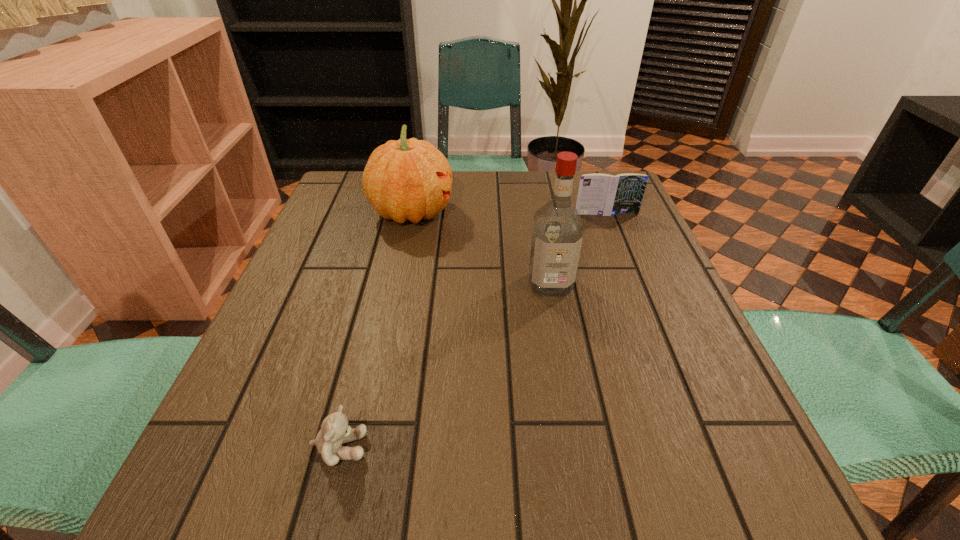
At what (x,y) coordinates should I click in order to perform the action: click on vacant space positioned on the face of the nearest object. Please return your answer as a coordinate pair (x, y). Looking at the image, I should click on (540, 448).

Locate an element on the screen. The height and width of the screenshot is (540, 960). pumpkin that is at the far edge is located at coordinates (409, 179).

You are a GUI agent. You are given a task and a screenshot of the screen. Output one action in this format:
    pyautogui.click(x=<x>, y=<y>)
    Task: Click on the book at the far edge
    
    Given the screenshot: What is the action you would take?
    pyautogui.click(x=599, y=194)

Where is `object that is at the near edge`? The image size is (960, 540). object that is at the near edge is located at coordinates (335, 430).

Where is `object that is at the left edge`? The height and width of the screenshot is (540, 960). object that is at the left edge is located at coordinates (409, 179).

Image resolution: width=960 pixels, height=540 pixels. In order to click on object present at the right edge in this screenshot , I will do `click(599, 194)`.

The height and width of the screenshot is (540, 960). What are the coordinates of `object present at the far left corner` in the screenshot? It's located at (409, 179).

Locate an element on the screen. object present at the far right corner is located at coordinates (599, 194).

In the image, there is a desktop. Find the location of `vacant space at the far edge`. vacant space at the far edge is located at coordinates (463, 198).

Identify the location of vacant area at the near edge of the desktop. Image resolution: width=960 pixels, height=540 pixels. (382, 469).